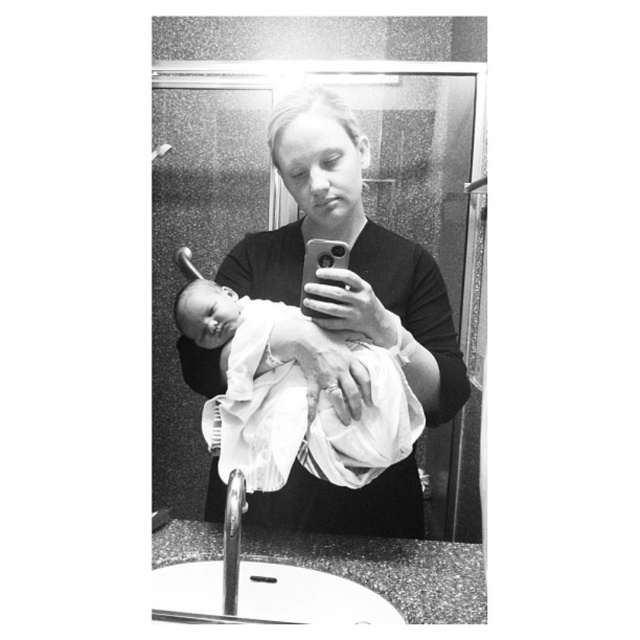
Question: Which of the following is the closest to the observer?

Choices:
 (A) white clothed baby at center
 (B) soft white swaddle at center

Answer: (B)

Question: In this image, where is soft white swaddle at center located relative to white clothed baby at center?

Choices:
 (A) above
 (B) below

Answer: (A)

Question: Can you confirm if soft white swaddle at center is positioned to the left of white clothed baby at center?

Choices:
 (A) no
 (B) yes

Answer: (A)

Question: Can you confirm if soft white swaddle at center is thinner than white clothed baby at center?

Choices:
 (A) yes
 (B) no

Answer: (B)

Question: Among these objects, which one is farthest from the camera?

Choices:
 (A) soft white swaddle at center
 (B) white clothed baby at center

Answer: (B)